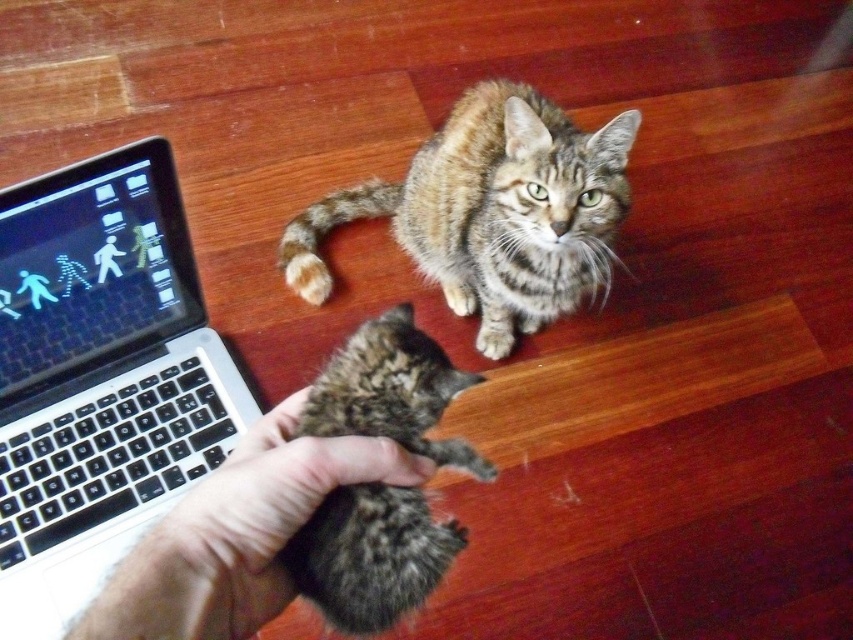
Which of these two, black plastic laptop at left or tabby fur kitten at center, stands shorter?

With less height is tabby fur kitten at center.

Between black plastic laptop at left and tabby fur kitten at center, which one is positioned higher?

black plastic laptop at left is higher up.

Between point (227, 385) and point (381, 394), which one is positioned in front?

Point (381, 394) is more forward.

The image size is (853, 640). Identify the location of black plastic laptop at left. (99, 378).

Does black plastic laptop at left appear on the left side of fur at center?

Correct, you'll find black plastic laptop at left to the left of fur at center.

Consider the image. Does black plastic laptop at left have a greater width compared to fur at center?

Yes.

The image size is (853, 640). Describe the element at coordinates (99, 378) in the screenshot. I see `black plastic laptop at left` at that location.

Locate an element on the screen. The width and height of the screenshot is (853, 640). black plastic laptop at left is located at coordinates (99, 378).

Between fur at center and tabby fur kitten at center, which one has less height?

With less height is fur at center.

Can you confirm if fur at center is shorter than tabby fur kitten at center?

Yes.

Is point (291, 496) less distant than point (364, 369)?

Yes, point (291, 496) is closer to viewer.

Locate an element on the screen. This screenshot has width=853, height=640. fur at center is located at coordinates (236, 534).